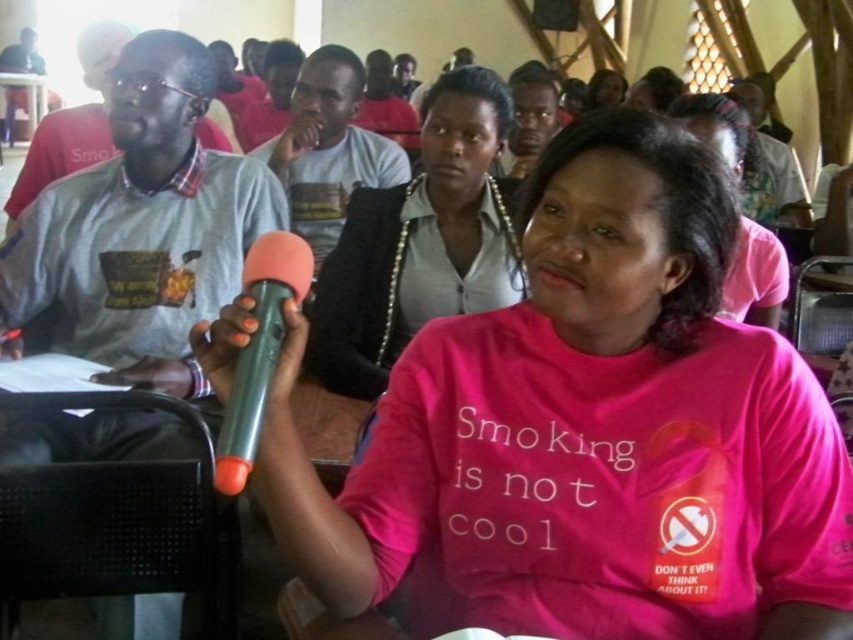
You are an attendee at the event and want to move from your seat to the exit door located at point (286, 124). There is an obstacle at point (363, 227) blocking your path. Can you go around the obstacle to reach the exit?

Point (363, 227) is in front of point (286, 124), so you can go around the obstacle to reach the exit.

You are organizing a fashion show and need to arrange two shirts displayed at the center of the stage. The white glossy shirt at center and the matte white shirt at center. According to the image, which shirt should be placed lower on the stage to follow the arrangement shown?

The white glossy shirt at center should be placed lower on the stage because it is positioned under the matte white shirt at center in the image.